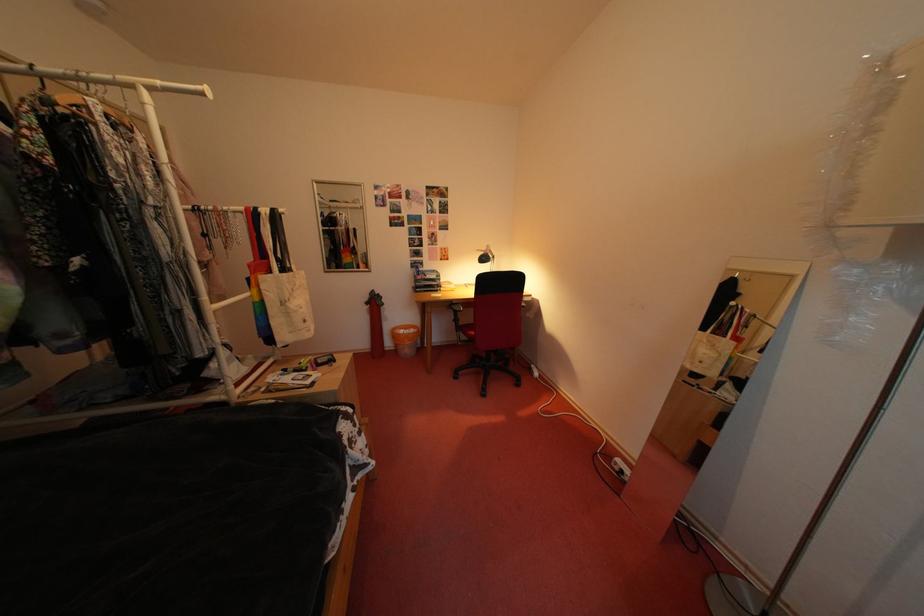
Which object does [275,282] point to?

This point indicates the white tote bag.